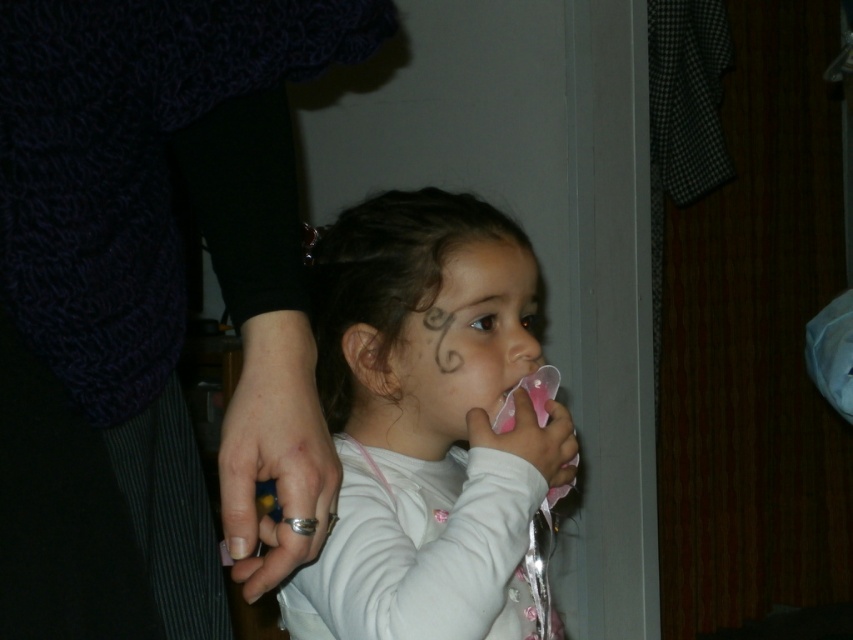
You are a parent trying to decide whether to put the knitted dark blue sweater at upper left into a drawer that can only hold items shorter than the silver metallic teething ring at lower center. Based on the image, will the sweater fit?

The knitted dark blue sweater at upper left is taller than the silver metallic teething ring at lower center, so it will not fit into the drawer since the sweater is taller than the allowed height.

You are a parent trying to choose between the knitted dark blue sweater at upper left and the silver metallic teething ring at lower center for your child. Based on their sizes, which item would be more suitable for a child to hold comfortably?

The knitted dark blue sweater at upper left is wider than the silver metallic teething ring at lower center, so the silver metallic teething ring at lower center would be more suitable for a child to hold comfortably as it is smaller and easier to grip.

You are trying to determine which of the two points, point (453, 264) or point (482, 240), is closer to you in the image. Based on the scene, which point is nearer?

Point (453, 264) is closer to the viewer than point (482, 240).